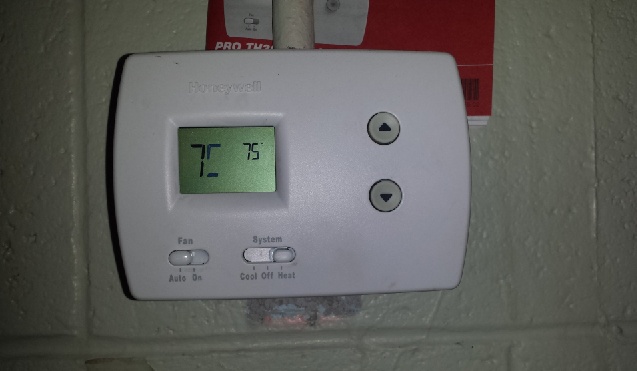
Identify the location of wall. (504, 147).